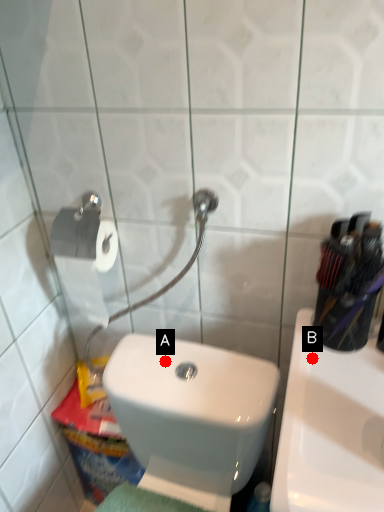
Question: Two points are circled on the image, labeled by A and B beside each circle. Which of the following is the closest to the observer?

Choices:
 (A) A is closer
 (B) B is closer

Answer: (B)